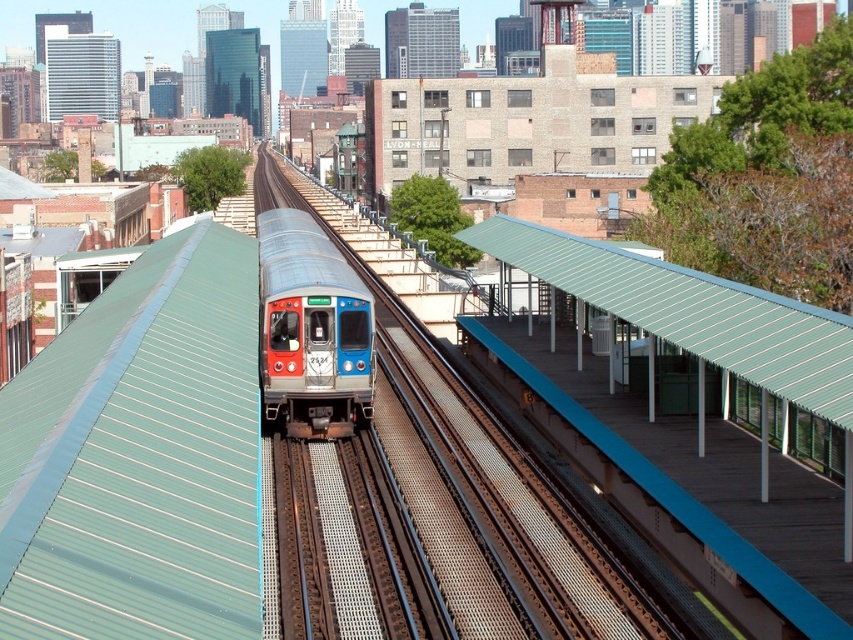
Question: Based on their relative distances, which object is farther from the smooth steel train track at center?

Choices:
 (A) green metal platform at right
 (B) metallic blue train at center

Answer: (B)

Question: Among these objects, which one is nearest to the camera?

Choices:
 (A) metallic blue train at center
 (B) green metal platform at right

Answer: (B)

Question: Considering the relative positions of smooth steel train track at center and metallic blue train at center in the image provided, where is smooth steel train track at center located with respect to metallic blue train at center?

Choices:
 (A) below
 (B) above

Answer: (B)

Question: Can you confirm if green metal platform at right is positioned below metallic blue train at center?

Choices:
 (A) no
 (B) yes

Answer: (B)

Question: Which object is farther from the camera taking this photo?

Choices:
 (A) metallic blue train at center
 (B) green metal platform at right

Answer: (A)

Question: Can you confirm if smooth steel train track at center is positioned below metallic blue train at center?

Choices:
 (A) yes
 (B) no

Answer: (B)